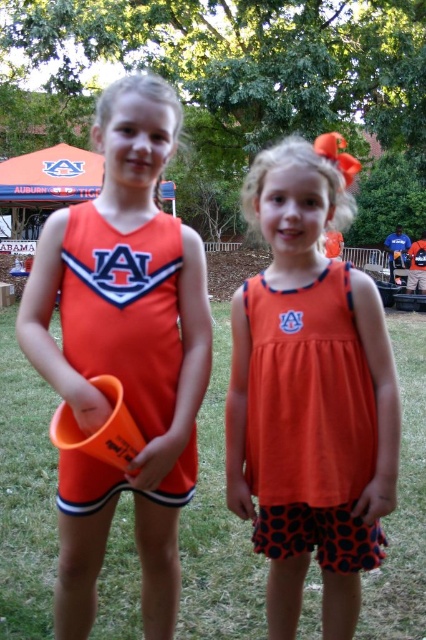
Question: Does orange fabric dress at center have a lesser width compared to orange jersey at center?

Choices:
 (A) yes
 (B) no

Answer: (B)

Question: Which of the following is the farthest from the observer?

Choices:
 (A) orange fabric dress at center
 (B) orange jersey at center
 (C) matte orange cheerleading outfit at center

Answer: (A)

Question: Does matte orange cheerleading outfit at center have a larger size compared to orange jersey at center?

Choices:
 (A) no
 (B) yes

Answer: (B)

Question: Which point is closer to the camera?

Choices:
 (A) (327, 568)
 (B) (123, 310)

Answer: (B)

Question: Does matte orange cheerleading outfit at center have a greater width compared to orange fabric dress at center?

Choices:
 (A) no
 (B) yes

Answer: (B)

Question: Which is nearer to the orange fabric dress at center?

Choices:
 (A) orange jersey at center
 (B) matte orange cheerleading outfit at center

Answer: (A)